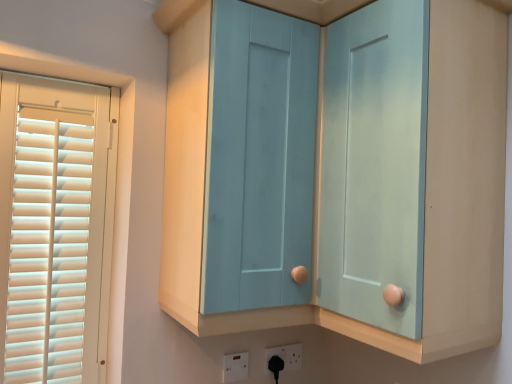
Question: From a real-world perspective, relative to matte blue cabinet at center, is white plastic electric outlet at lower center, the 1th electric outlet when ordered from left to right, vertically above or below?

Choices:
 (A) below
 (B) above

Answer: (A)

Question: Is white plastic electric outlet at lower center, the 1th electric outlet when ordered from left to right, in front of or behind matte blue cabinet at center in the image?

Choices:
 (A) behind
 (B) front

Answer: (A)

Question: Estimate the real-world distances between objects in this image. Which object is farther from the matte blue cabinet at center?

Choices:
 (A) white plastic electric outlet at lower center, acting as the first electric outlet starting from the front
 (B) light blue wood cabinet at center
 (C) white plastic socket at lower center, the 2th electric outlet from the left

Answer: (C)

Question: Which object is the closest to the white plastic socket at lower center, acting as the 1th electric outlet starting from the back?

Choices:
 (A) light blue wood cabinet at center
 (B) white plastic electric outlet at lower center, the 2th electric outlet positioned from the back
 (C) matte blue cabinet at center

Answer: (B)